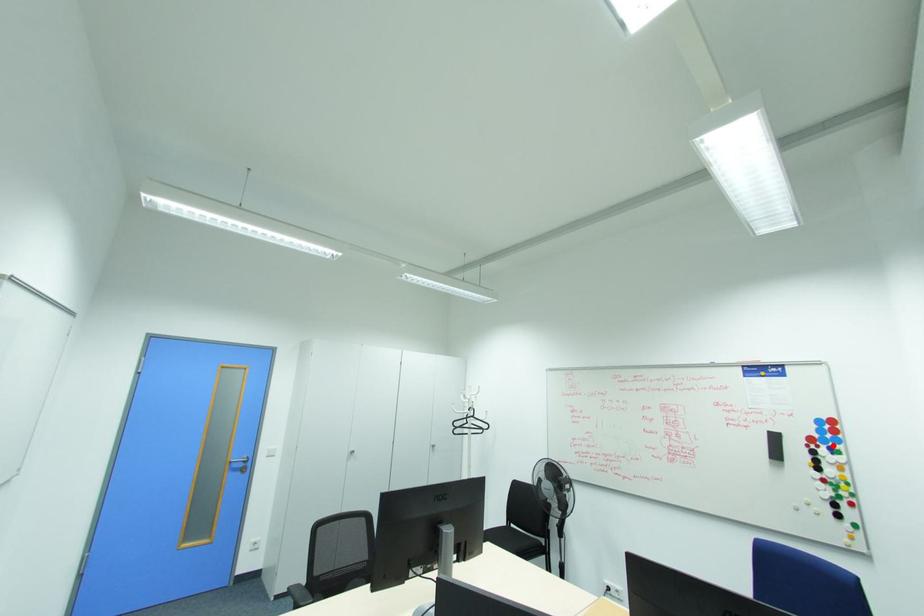
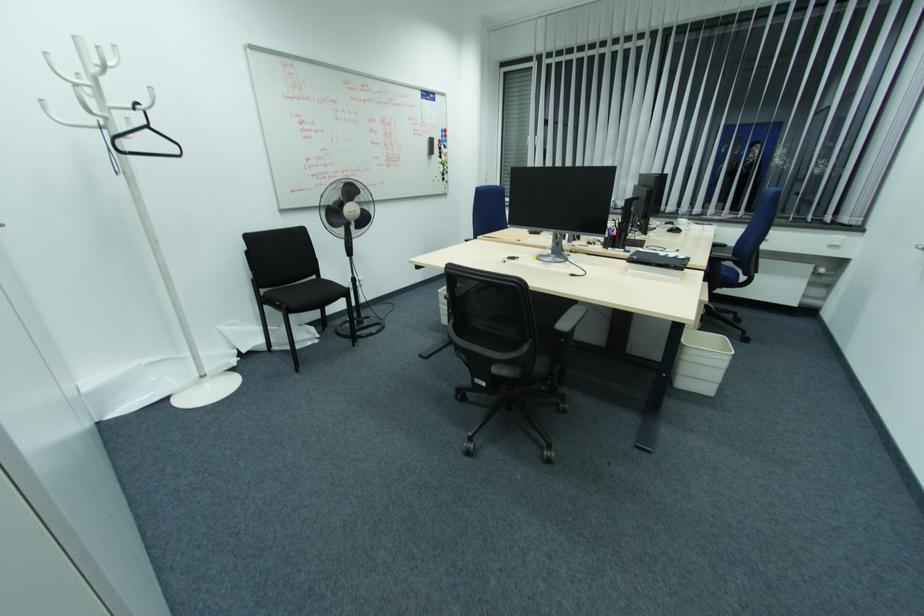
Locate, in the second image, the point that corresponds to the highlighted location in the first image.

(445, 144)